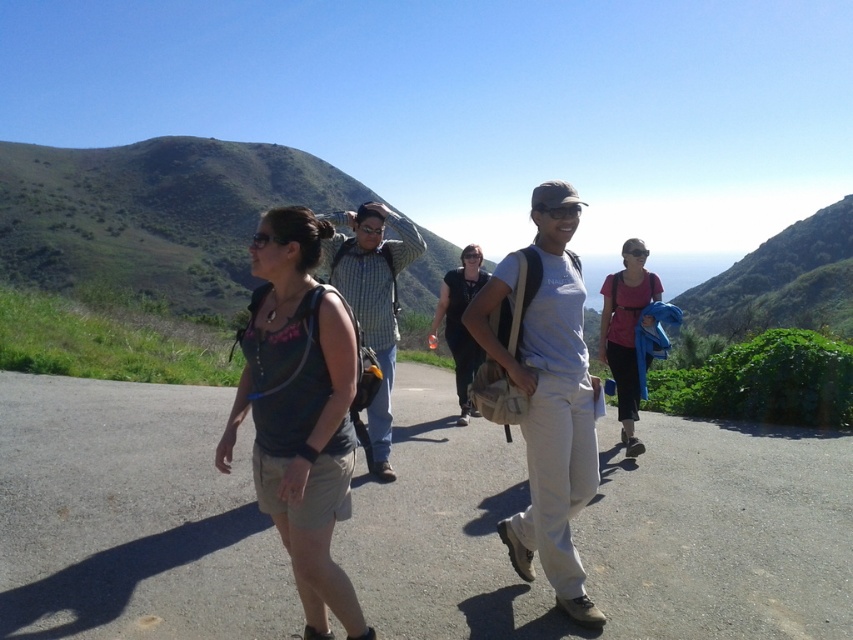
You are a photographer trying to capture a group photo of the matte black tank top at center and the camera. If you want to ensure both subjects are in focus, what is the minimum distance you should set your camera lens to?

The matte black tank top at center and the camera are 8.03 feet apart from each other. To ensure both are in focus, the camera lens should be set to a distance that accommodates this separation, typically using a depth of field that covers at least 8.03 feet.

You are a photographer trying to capture a group photo of the matte black tank top at center and the plaid fabric shirt at center. Since you want to ensure both subjects are clearly visible, which clothing item should you focus on first to avoid blurriness due to their sizes?

The matte black tank top at center has a lesser width compared to the plaid fabric shirt at center, so you should focus on the plaid fabric shirt at center first because it is larger and might require more precise focusing to ensure clarity.